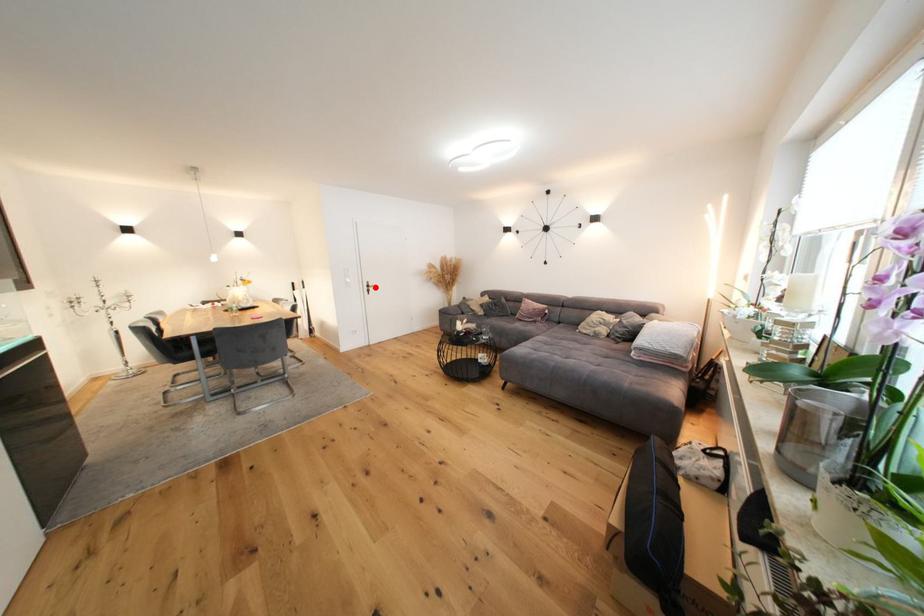
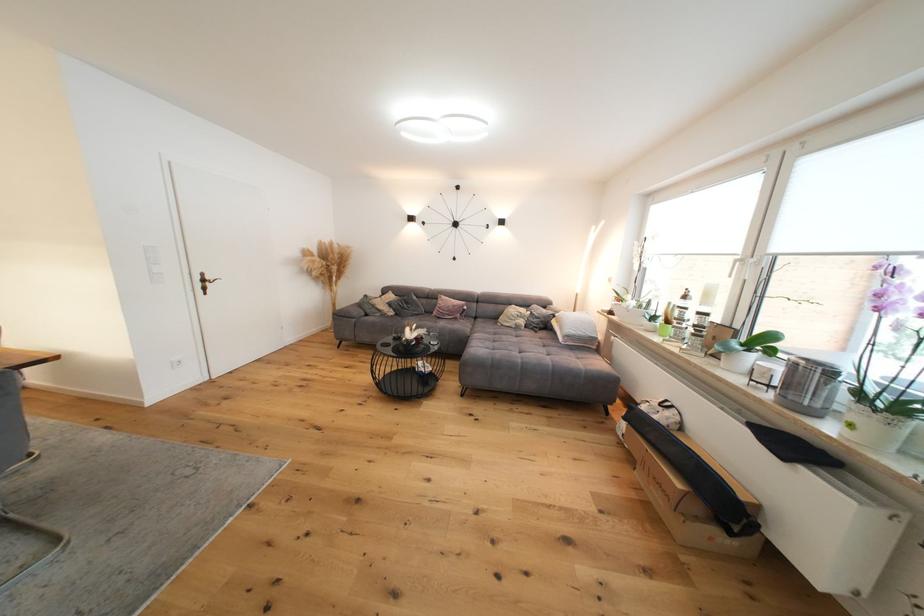
Locate, in the second image, the point that corresponds to the highlighted location in the first image.

(211, 282)